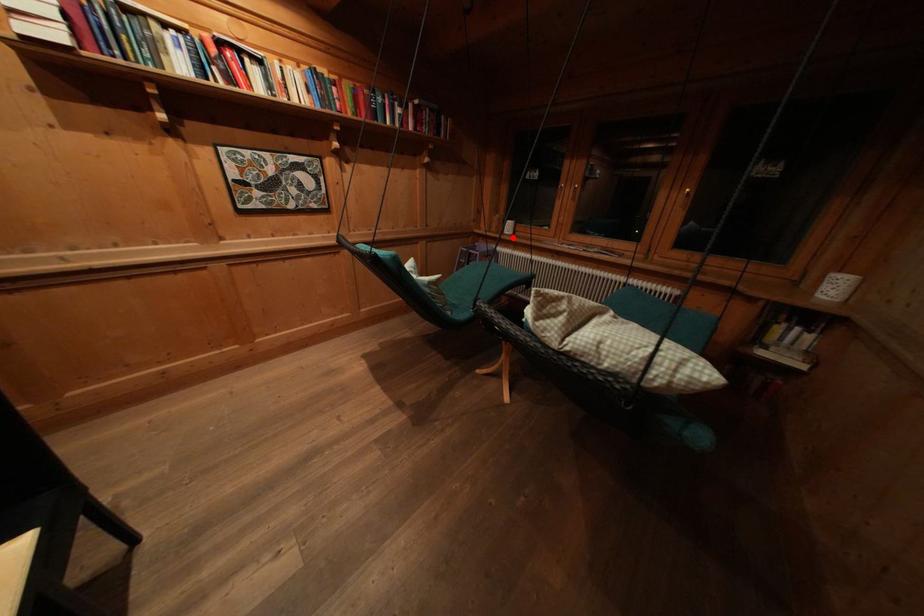
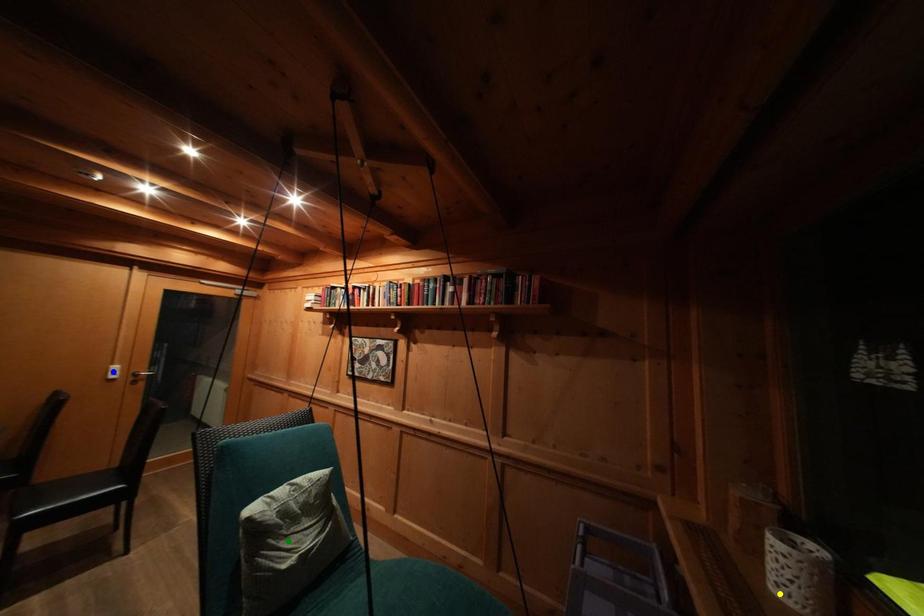
Question: I am providing you with two images of the same scene from different viewpoints. A red point is marked on the first image. You are given multiple points on the second image. Which point in image 2 represents the same 3d spot as the red point in image 1?

Choices:
 (A) green point
 (B) blue point
 (C) yellow point

Answer: (C)